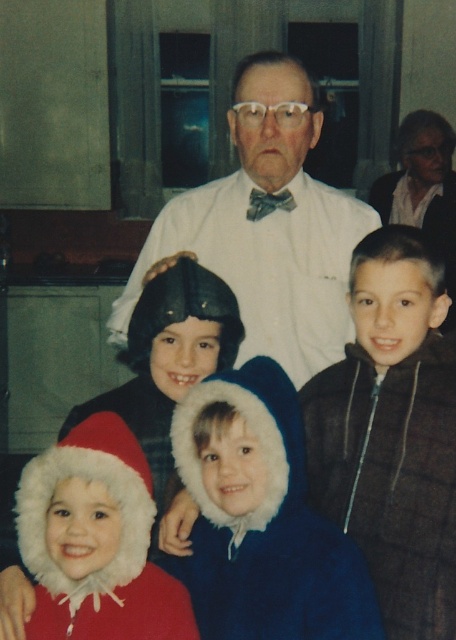
Based on the scene description and the coordinates provided, which object is located at the point with coordinates [393,433]?

The point at coordinates [393,433] corresponds to the brown plaid jacket at right.

You are trying to find the brown plaid jacket at right and the fuzzy blue coat at center in the family photo. Which one is positioned higher in the image?

The brown plaid jacket at right is located above the fuzzy blue coat at center, so it is positioned higher in the image.